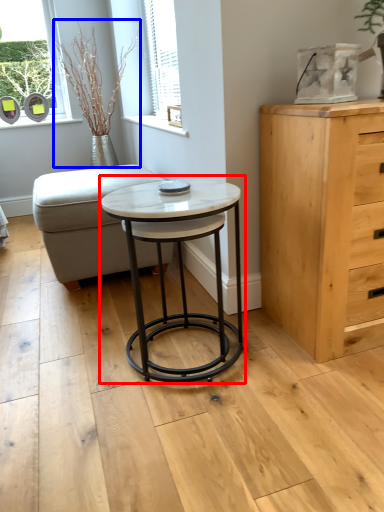
Question: Which point is closer to the camera, coffee table (highlighted by a red box) or plant (highlighted by a blue box)?

Choices:
 (A) coffee table
 (B) plant

Answer: (A)